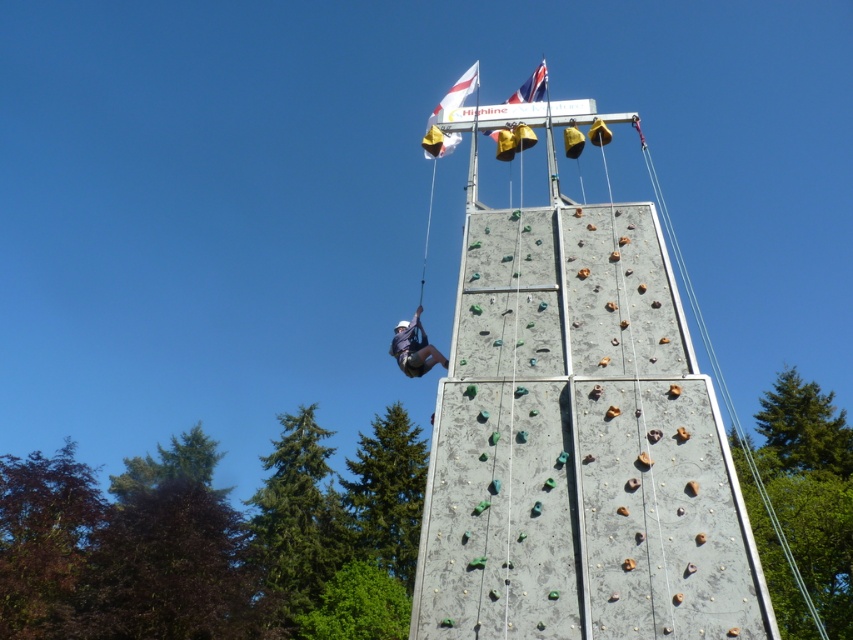
You are standing on the ground in front of the climbing wall. If you want to reach the top platform where the Highline sign is located, which direction should you climb towards based on the concrete climbing wall at center?

The concrete climbing wall at center is located at point [577,442], so you should climb towards the top of the concrete climbing wall at center to reach the Highline platform.

You are a climber preparing to ascend the climbing wall. You notice the white fabric helmet at upper center and the british flag at top. Which object is nearer to you as you stand at the base of the wall?

The white fabric helmet at upper center is closer to you than the British flag at top, so the white fabric helmet at upper center is nearer.